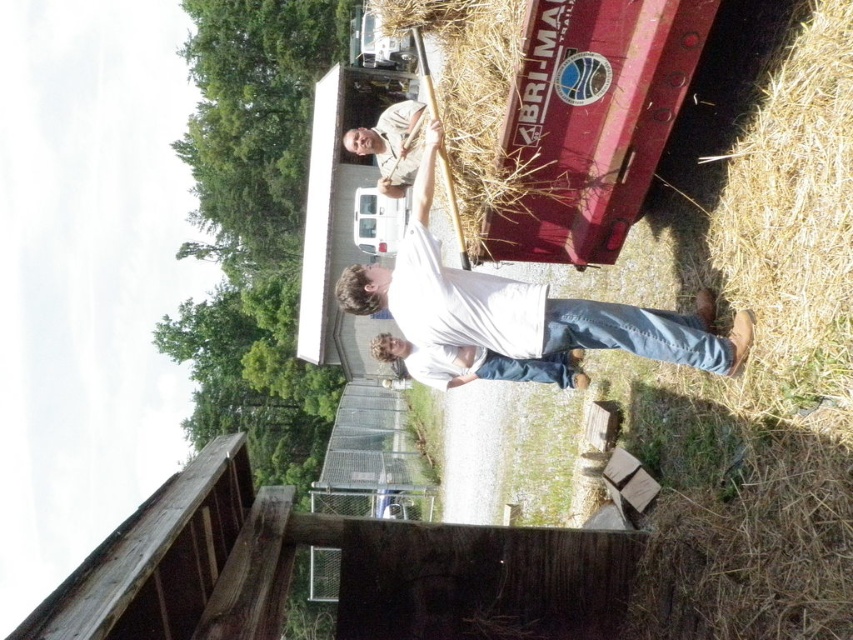
What is located at the point with coordinates (759,353) in the image?

The point at coordinates (759,353) corresponds to light brown straw at lower right.

You are a farmer checking the storage area. You see the light brown straw at lower right and the camouflage shirt at upper center. Which object is shorter in height?

The light brown straw at lower right is shorter than the camouflage shirt at upper center.